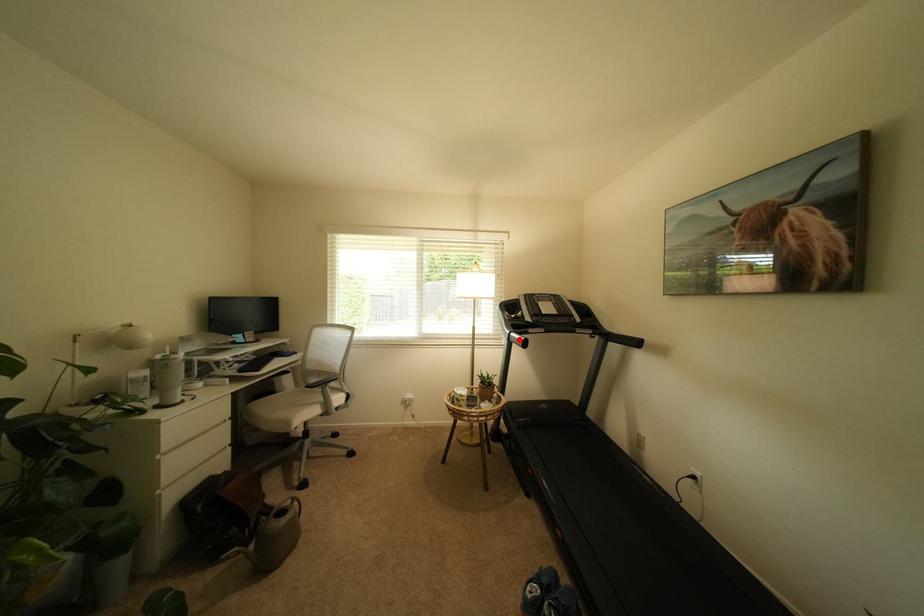
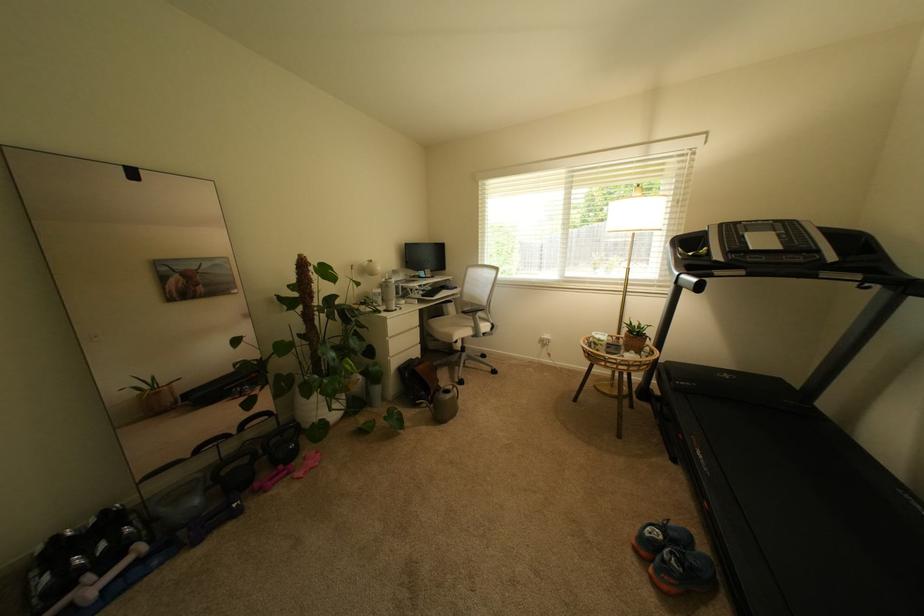
Question: I am providing you with two images of the same scene from different viewpoints. Image1 has a red point marked. In image2, the corresponding 3D location appears at what relative position? Reply with the corresponding letter.

Choices:
 (A) Closer
 (B) Farther

Answer: (A)